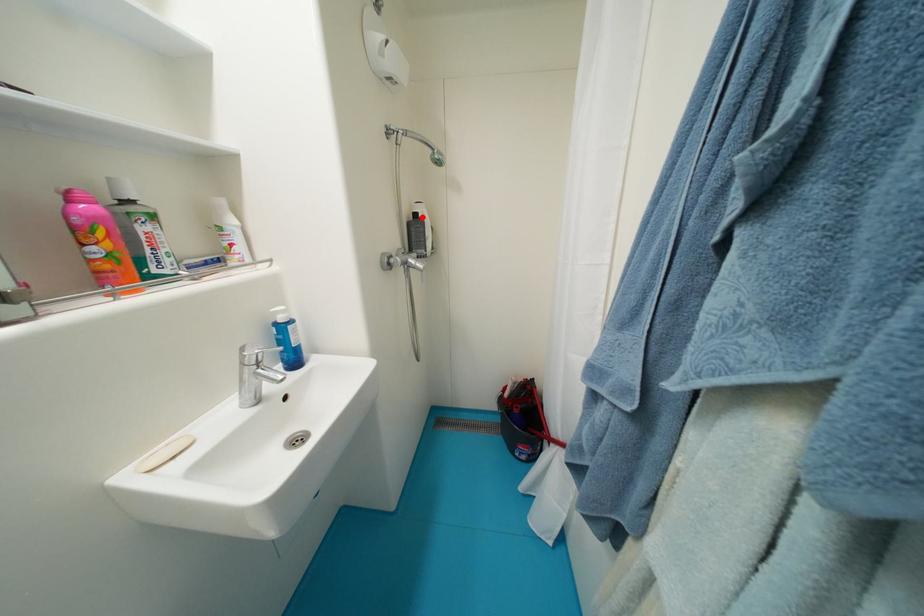
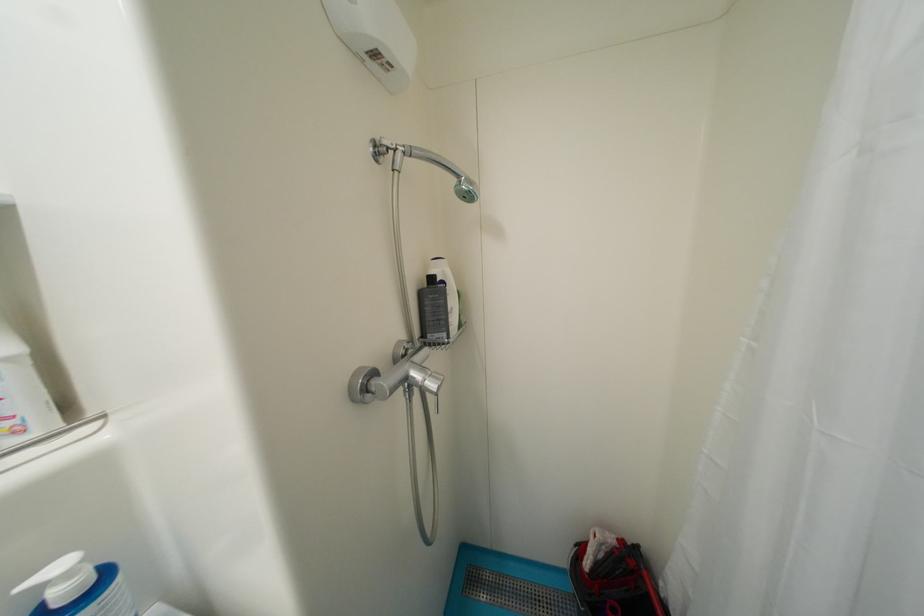
In the second image, find the point that corresponds to the highlighted location in the first image.

(439, 281)